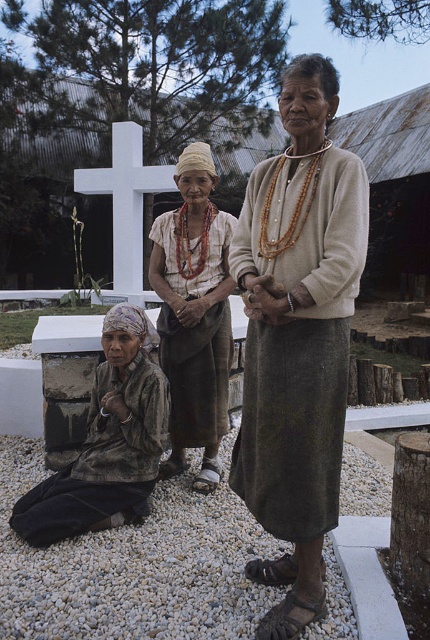
Question: Can you confirm if beige fabric skirt at center is positioned below beige woven fabric dress at center?

Choices:
 (A) yes
 (B) no

Answer: (A)

Question: Considering the relative positions of beige fabric skirt at center and white gravel at lower center in the image provided, where is beige fabric skirt at center located with respect to white gravel at lower center?

Choices:
 (A) right
 (B) left

Answer: (A)

Question: Which point is farther from the camera taking this photo?

Choices:
 (A) (206, 225)
 (B) (181, 579)
 (C) (325, 67)
 (D) (160, 168)

Answer: (D)

Question: Among these points, which one is nearest to the camera?

Choices:
 (A) (349, 630)
 (B) (168, 339)

Answer: (A)

Question: Among these objects, which one is farthest from the camera?

Choices:
 (A) beige fabric skirt at center
 (B) beige woven fabric dress at center

Answer: (B)

Question: Observing the image, what is the correct spatial positioning of white gravel at lower center in reference to beige woven fabric dress at center?

Choices:
 (A) above
 (B) below

Answer: (B)